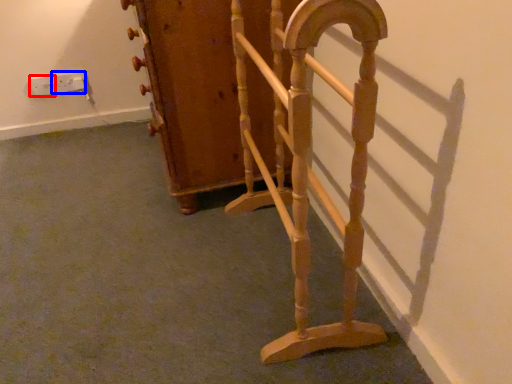
Question: Which point is further to the camera, electric outlet (highlighted by a red box) or electric outlet (highlighted by a blue box)?

Choices:
 (A) electric outlet
 (B) electric outlet

Answer: (B)